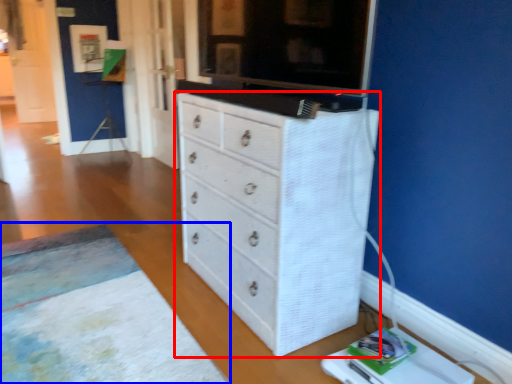
Question: Which object is further to the camera taking this photo, chest of drawers (highlighted by a red box) or plain (highlighted by a blue box)?

Choices:
 (A) chest of drawers
 (B) plain

Answer: (A)